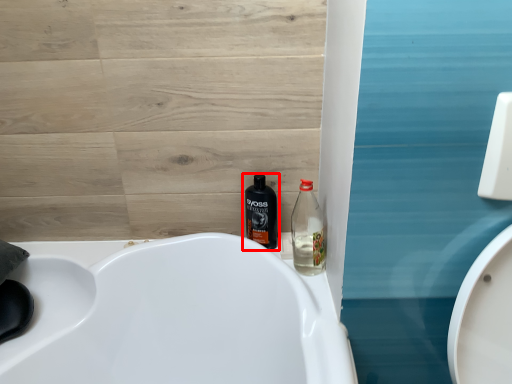
Question: From the image's perspective, where is bottle (annotated by the red box) located in relation to bottle in the image?

Choices:
 (A) above
 (B) below

Answer: (A)